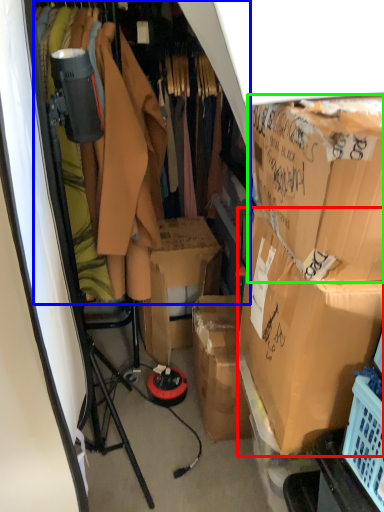
Question: Based on their relative distances, which object is nearer to box (highlighted by a red box)? Choose from closet (highlighted by a blue box) and box (highlighted by a green box).

Choices:
 (A) closet
 (B) box

Answer: (B)